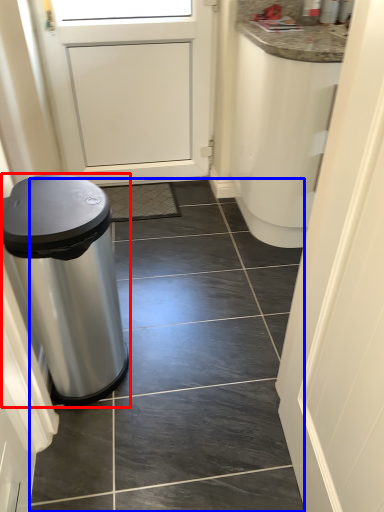
Question: Which object is closer to the camera taking this photo, waste container (highlighted by a red box) or tile (highlighted by a blue box)?

Choices:
 (A) waste container
 (B) tile

Answer: (A)